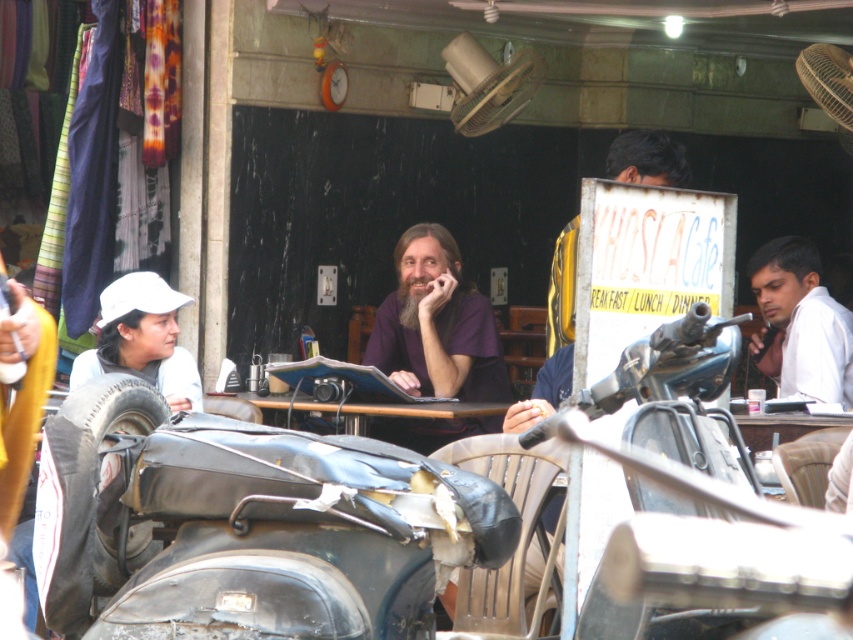
You are standing at the position of the camera, looking at the street scene. There are two points marked in the image. The first point is at coordinates point (x=461, y=372) and the second point is at point (x=756, y=275). Which point is nearer to you?

Point (x=461, y=372) is closer to the camera than point (x=756, y=275).

You are standing at the point marked as point (142, 339) in the scene. What object is located to your left?

The white matte cap at left is located to your left at point (142, 339).

In the scene shown: You are a photographer standing in front of the KHOSLA Cafe sign. You notice two people sitting at a table inside the cafe. One is wearing a dark purple shirt at center and the other a white matte shirt at right. Which shirt is closer to the left side of the table?

The dark purple shirt at center is positioned on the left side of white matte shirt at right, so the dark purple shirt at center is closer to the left side of the table.